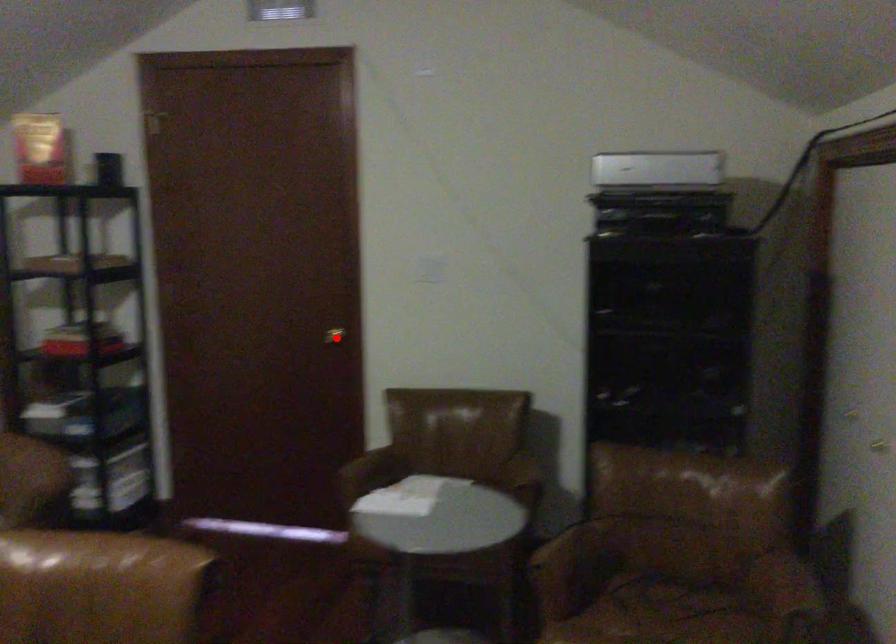
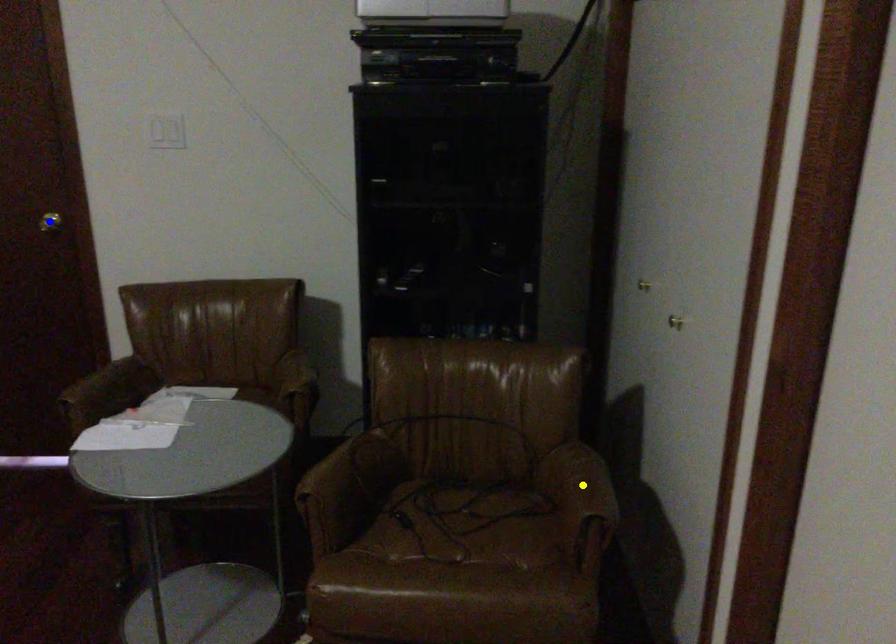
Question: I am providing you with two images of the same scene from different viewpoints. A red point is marked on the first image. You are given multiple points on the second image. In image 2, which mark is for the same physical point as the one in image 1?

Choices:
 (A) green point
 (B) yellow point
 (C) blue point

Answer: (C)